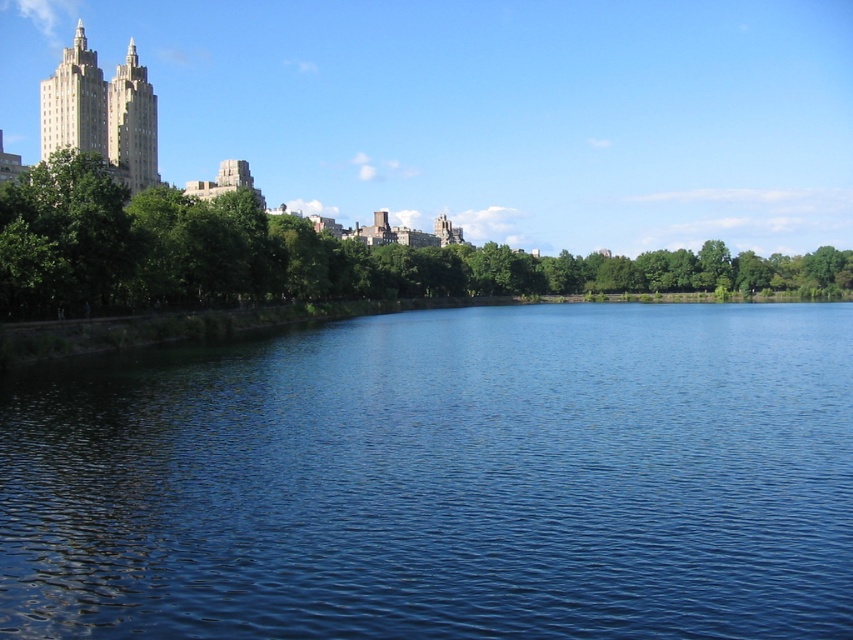
You are a photographer planning to capture the blue liquid at center and the green leafy trees at upper left in a single frame. Based on their sizes, which object should you focus on first to ensure both are in focus?

The blue liquid at center has a smaller size compared to green leafy trees at upper left, so you should focus on the green leafy trees at upper left first to ensure both are in focus since the larger object requires more precise focusing to capture details.

You are a drone operator flying a drone over the urban landscape. You need to capture a photo of the blue liquid at center and the gold textured building at upper left. Which object should you position lower in the frame to ensure both are visible?

To ensure both the blue liquid at center and the gold textured building at upper left are visible, you should position the gold textured building at upper left higher in the frame since the blue liquid at center is located underneath it.

You are a bird flying over the urban landscape. You see the blue liquid at center and the green leafy trees at upper left. Which object is located lower in the image?

The blue liquid at center is positioned under the green leafy trees at upper left, so it is located lower in the image.